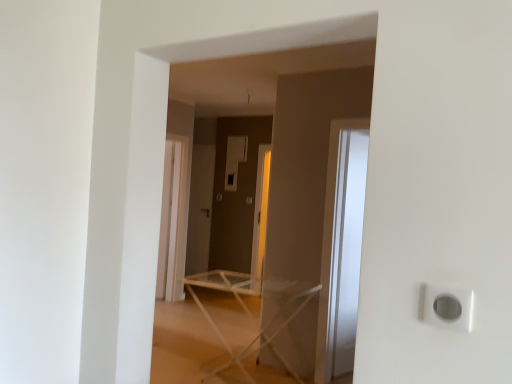
Question: Considering the relative sizes of white plastic outlet at lower right and white plastic ironing board at center in the image provided, is white plastic outlet at lower right taller than white plastic ironing board at center?

Choices:
 (A) yes
 (B) no

Answer: (B)

Question: Does white plastic outlet at lower right appear on the right side of white plastic ironing board at center?

Choices:
 (A) no
 (B) yes

Answer: (B)

Question: Is white plastic outlet at lower right oriented towards white plastic ironing board at center?

Choices:
 (A) yes
 (B) no

Answer: (B)

Question: Is white plastic outlet at lower right surrounding white plastic ironing board at center?

Choices:
 (A) yes
 (B) no

Answer: (B)

Question: Is white plastic outlet at lower right turned away from white plastic ironing board at center?

Choices:
 (A) yes
 (B) no

Answer: (B)

Question: Is white plastic outlet at lower right not near white plastic ironing board at center?

Choices:
 (A) no
 (B) yes

Answer: (B)

Question: Is white plastic outlet at lower right closer to the viewer compared to transparent glass door at right?

Choices:
 (A) yes
 (B) no

Answer: (A)

Question: From the image's perspective, is white plastic outlet at lower right over transparent glass door at right?

Choices:
 (A) no
 (B) yes

Answer: (B)

Question: From a real-world perspective, is white plastic outlet at lower right located beneath transparent glass door at right?

Choices:
 (A) no
 (B) yes

Answer: (A)

Question: Does white plastic outlet at lower right have a lesser width compared to transparent glass door at right?

Choices:
 (A) yes
 (B) no

Answer: (A)

Question: Is white plastic outlet at lower right bigger than transparent glass door at right?

Choices:
 (A) no
 (B) yes

Answer: (A)

Question: Considering the relative sizes of white plastic outlet at lower right and transparent glass door at right in the image provided, is white plastic outlet at lower right shorter than transparent glass door at right?

Choices:
 (A) no
 (B) yes

Answer: (B)

Question: Is white plastic ironing board at center oriented away from matte gray screen door at center?

Choices:
 (A) no
 (B) yes

Answer: (A)